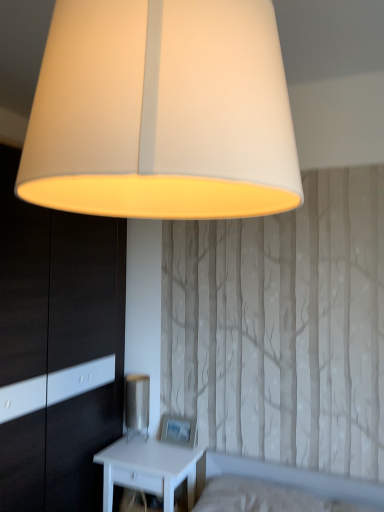
Image resolution: width=384 pixels, height=512 pixels. I want to click on vacant area in front of metallic silver table lamp at lower center, so click(x=134, y=450).